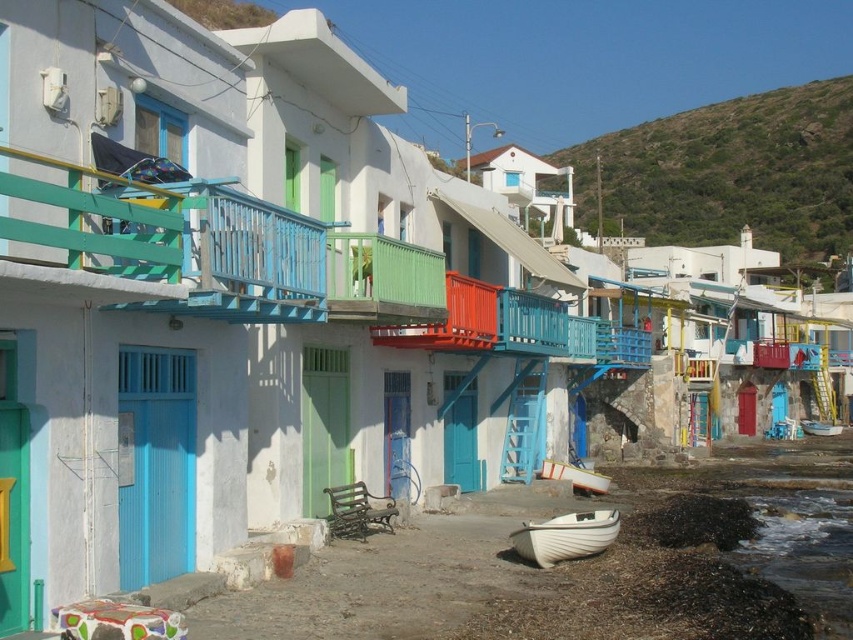
Question: Does green grassy hillside at upper center have a greater width compared to white plastic boat at lower right?

Choices:
 (A) yes
 (B) no

Answer: (A)

Question: Which point appears closest to the camera in this image?

Choices:
 (A) (610, 529)
 (B) (601, 486)

Answer: (A)

Question: Which is nearer to the white plastic boat at lower right?

Choices:
 (A) white matte boat at lower center
 (B) white plastic boat at lower center

Answer: (B)

Question: Does white matte boat at lower center have a greater width compared to white plastic boat at lower center?

Choices:
 (A) yes
 (B) no

Answer: (A)

Question: Which point is farther to the camera?

Choices:
 (A) pos(811,426)
 (B) pos(798,154)
 (C) pos(553,468)

Answer: (B)

Question: Is white matte boat at lower center positioned behind white plastic boat at lower right?

Choices:
 (A) yes
 (B) no

Answer: (B)